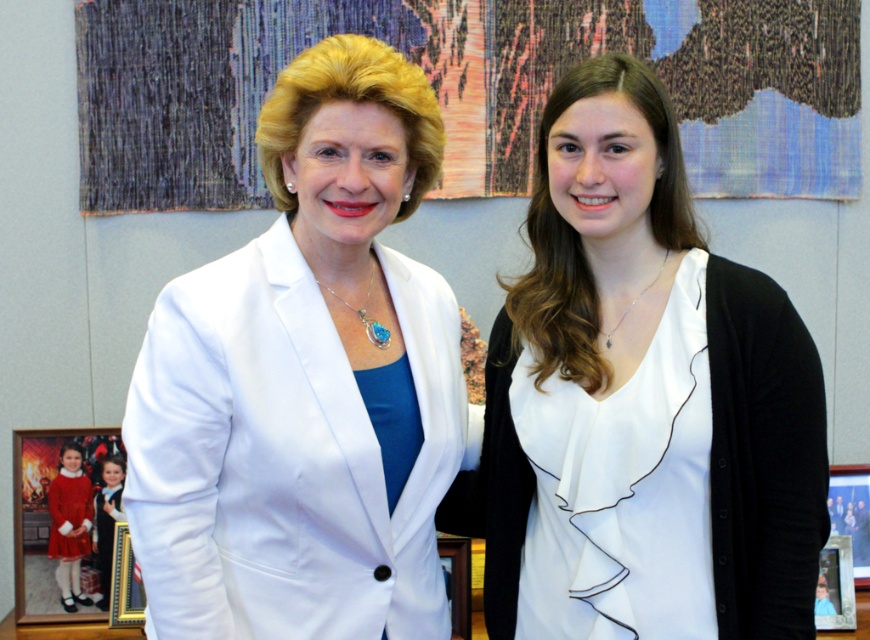
You are an interior designer analyzing the image. You need to place a small decorative item at the point marked by coordinates point [641,401]. Which object in the scene will this item be placed on?

The point [641,401] is located on the white matte blouse at center, so the decorative item will be placed on the white matte blouse at center.

You are an interior designer observing the two white garments in the image. The white matte blouse at center and the white smooth blazer at center. Which one is positioned more to the east side of the room?

The white matte blouse at center is to the right of the white smooth blazer at center, so if the room has a standard orientation with the entrance facing north, the white matte blouse at center would be more to the east side.

You are taking a photo of two people in an office setting. You notice two points marked in the image at coordinates point (x=534, y=387) and point (x=336, y=580). Which point is closer to the camera?

Point (x=534, y=387) is further to the camera than point (x=336, y=580), so the point closer to the camera is point (x=336, y=580).